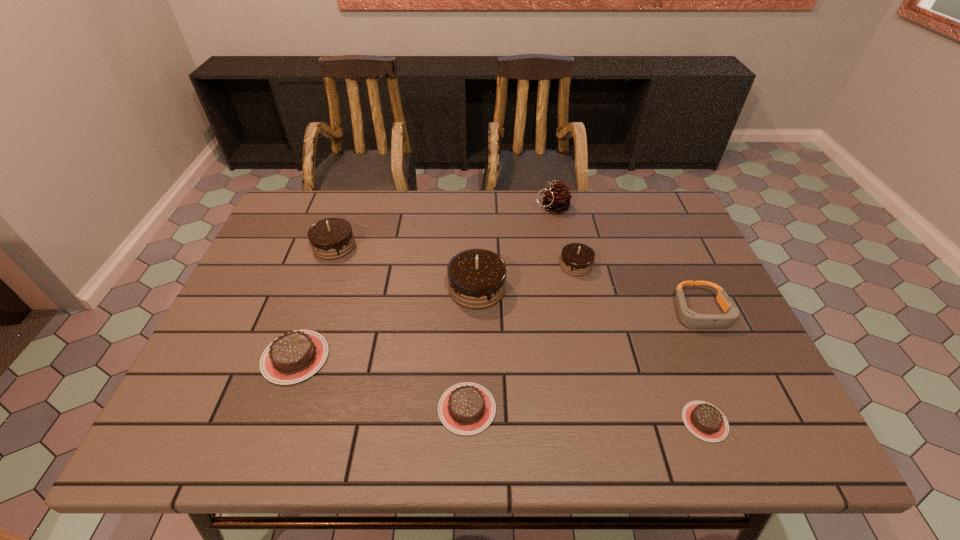
This screenshot has height=540, width=960. I want to click on vacant point located on the left of the fifth chocolate cake from left to right, so click(502, 265).

The width and height of the screenshot is (960, 540). Identify the location of vacant area located 0.140m on the front and back of the fourth shortest object. (x=736, y=390).

At what (x,y) coordinates should I click in order to perform the action: click on vacant space positioned on the right of the sixth tallest object. Please return your answer as a coordinate pair (x, y). The image size is (960, 540). Looking at the image, I should click on (437, 357).

At what (x,y) coordinates should I click in order to perform the action: click on vacant space located on the right of the second shortest object. Please return your answer as a coordinate pair (x, y). The height and width of the screenshot is (540, 960). Looking at the image, I should click on (615, 408).

Image resolution: width=960 pixels, height=540 pixels. Find the location of `vacant space located 0.270m on the back of the smallest brown chocolate cake`. vacant space located 0.270m on the back of the smallest brown chocolate cake is located at coordinates (660, 305).

This screenshot has height=540, width=960. In order to click on pinecone located at the far edge in this screenshot , I will do `click(557, 199)`.

I want to click on chocolate cake located in the far edge section of the desktop, so click(332, 238).

In order to click on goggles at the right edge in this screenshot , I will do `click(689, 318)`.

Locate an element on the screen. chocolate cake that is positioned at the right edge is located at coordinates point(704,420).

I want to click on object that is at the far left corner, so click(x=332, y=238).